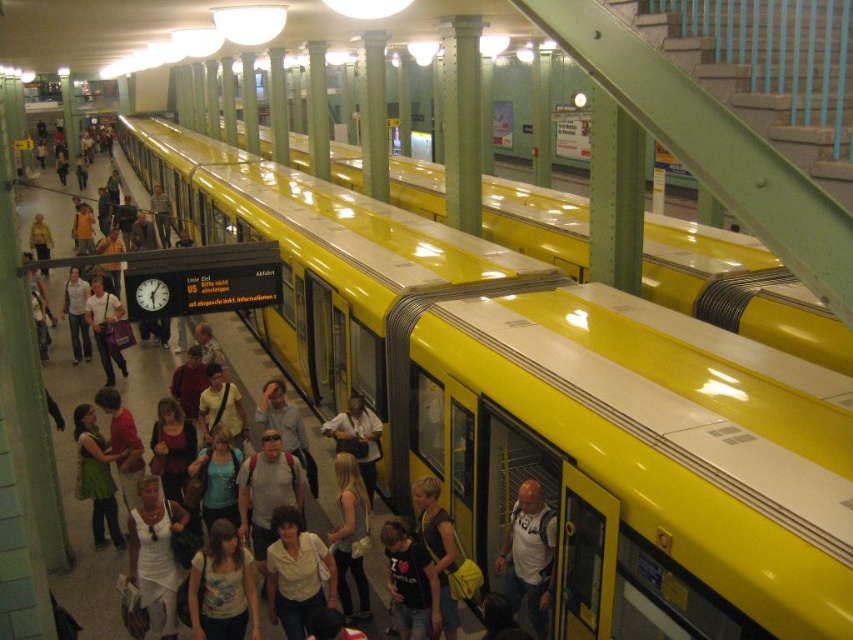
Question: Is yellow matte train at center thinner than yellow glossy train at center?

Choices:
 (A) no
 (B) yes

Answer: (B)

Question: Among these objects, which one is nearest to the camera?

Choices:
 (A) yellow glossy train at center
 (B) yellow matte train at center

Answer: (B)

Question: Which point appears closest to the camera in this image?

Choices:
 (A) (672, 259)
 (B) (672, 508)

Answer: (B)

Question: Can you confirm if yellow matte train at center is positioned above yellow glossy train at center?

Choices:
 (A) yes
 (B) no

Answer: (B)

Question: Does yellow matte train at center have a greater width compared to yellow glossy train at center?

Choices:
 (A) yes
 (B) no

Answer: (B)

Question: Which point appears farthest from the camera in this image?

Choices:
 (A) (442, 205)
 (B) (343, 307)

Answer: (A)